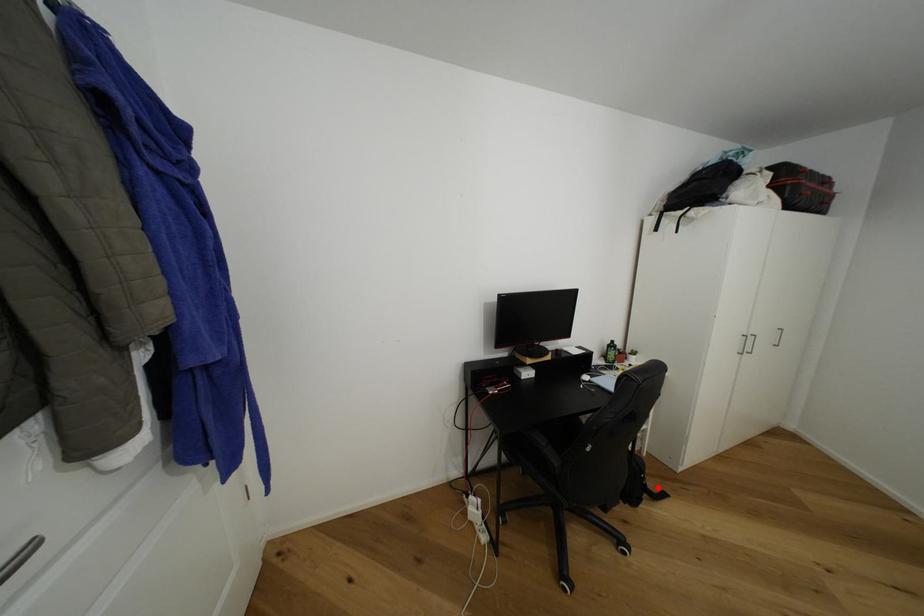
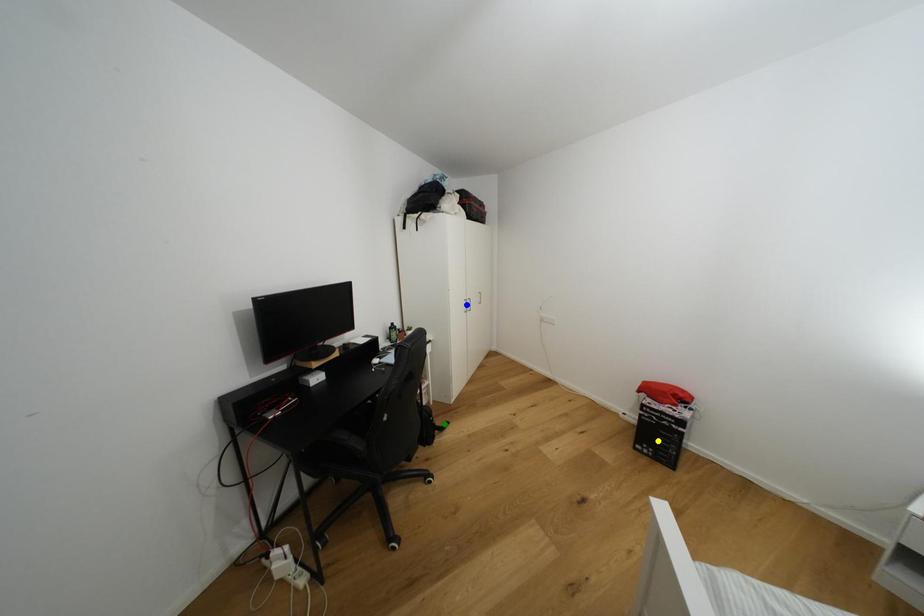
Question: I am providing you with two images of the same scene from different viewpoints. A red point is marked on the first image. You are given multiple points on the second image. Which point in image 2 represents the same 3d spot as the red point in image 1?

Choices:
 (A) blue point
 (B) yellow point
 (C) green point

Answer: (C)